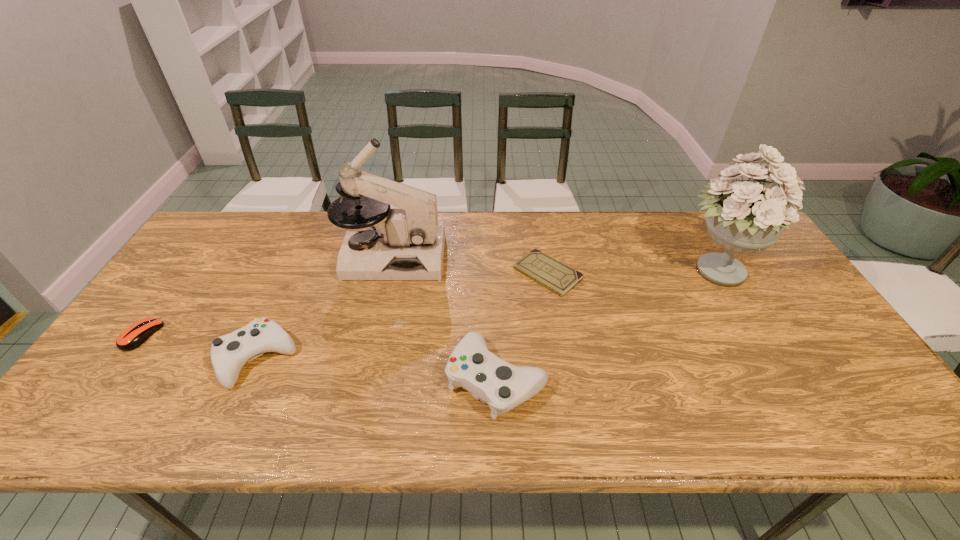
Locate an element on the screen. This screenshot has width=960, height=540. object at the far right corner is located at coordinates (746, 217).

In the image, there is a desktop. Identify the location of vacant space at the far edge. This screenshot has width=960, height=540. (516, 217).

At what (x,y) coordinates should I click in order to perform the action: click on vacant space at the near edge of the desktop. Please return your answer as a coordinate pair (x, y). Looking at the image, I should click on (664, 397).

Locate an element on the screen. The width and height of the screenshot is (960, 540). free point at the left edge is located at coordinates (168, 291).

Locate an element on the screen. vacant space at the right edge of the desktop is located at coordinates (769, 299).

Find the location of a particular element. This screenshot has height=540, width=960. vacant area at the near right corner is located at coordinates (832, 381).

Where is `free space between the microscope and the right control`? Image resolution: width=960 pixels, height=540 pixels. free space between the microscope and the right control is located at coordinates (444, 318).

Where is `vacant area that lies between the microscope and the computer mouse`? This screenshot has height=540, width=960. vacant area that lies between the microscope and the computer mouse is located at coordinates (267, 296).

Locate an element on the screen. The height and width of the screenshot is (540, 960). free space between the fourth object from right to left and the third shortest object is located at coordinates (324, 308).

The image size is (960, 540). I want to click on vacant space that's between the microscope and the computer mouse, so click(x=267, y=296).